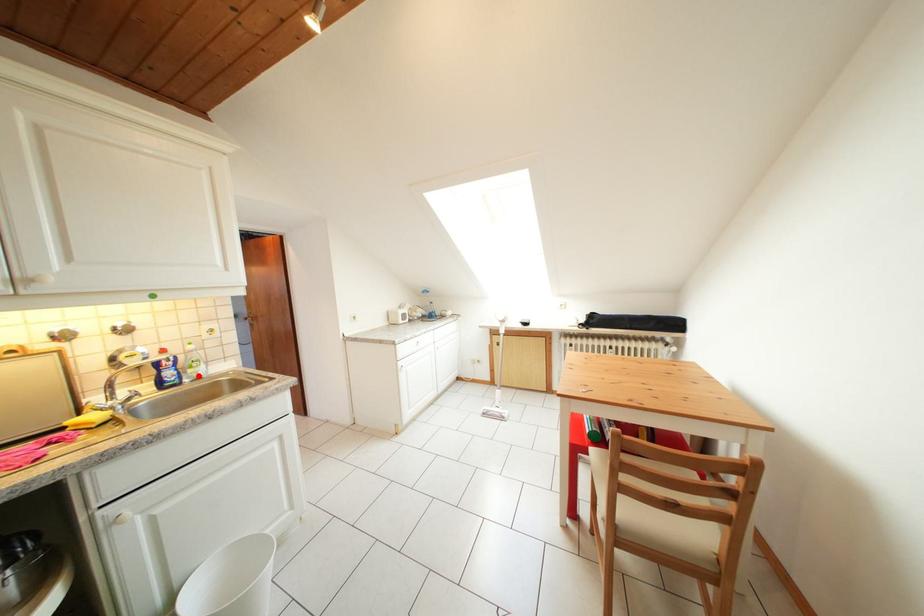
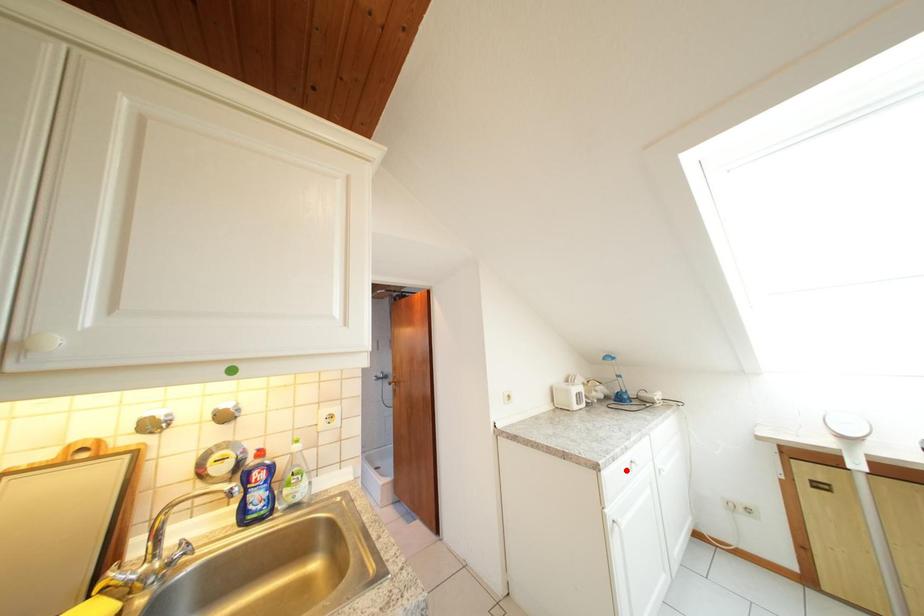
I am providing you with two images of the same scene from different viewpoints. A red point is marked on the first image and another point is marked on the second image. Are the points marked in image1 and image2 representing the same 3D position?

No